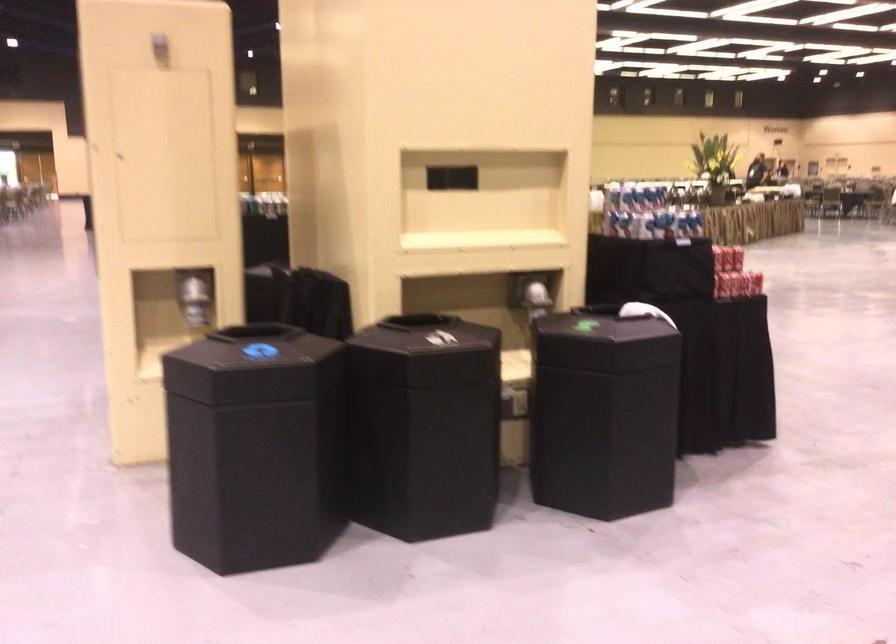
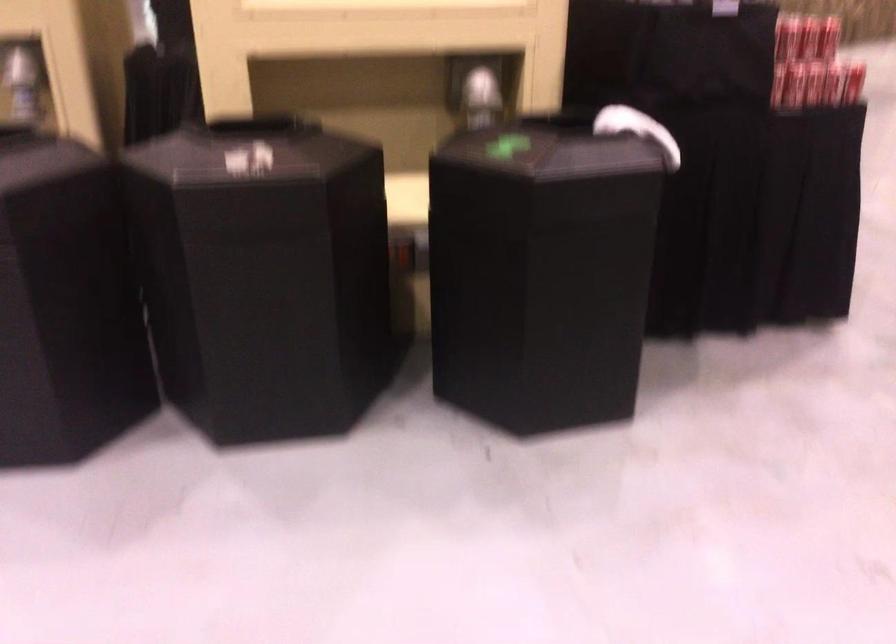
The point at (657, 313) is marked in the first image. Where is the corresponding point in the second image?

(636, 129)